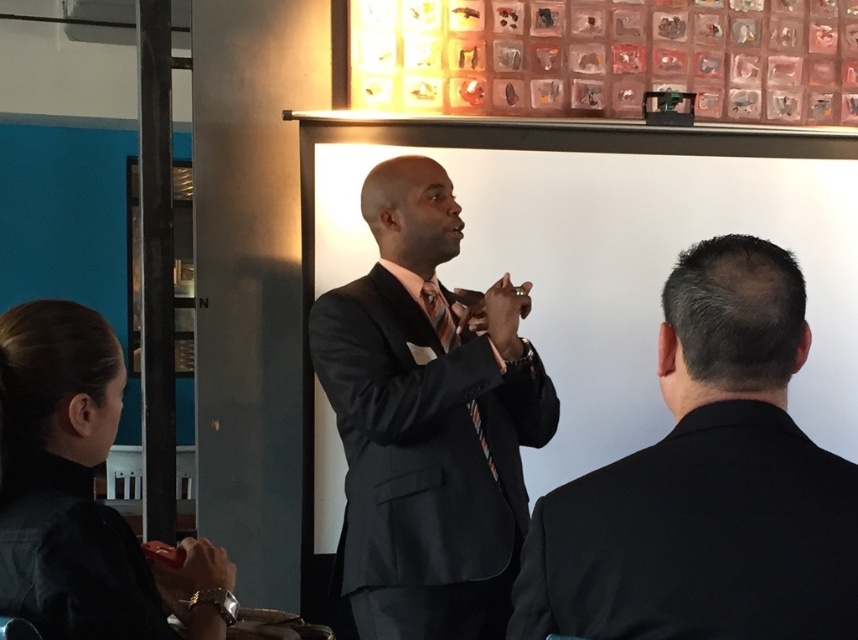
You are an event organizer and need to ensure there is enough space between the black suit at center and the striped silk tie at center for a microphone stand. The stand requires at least 40 inches of space. Based on the image, will the stand fit between them?

The black suit at center is 38.31 inches from the striped silk tie at center, which is less than the required 40 inches. Therefore, the microphone stand will not fit between them.